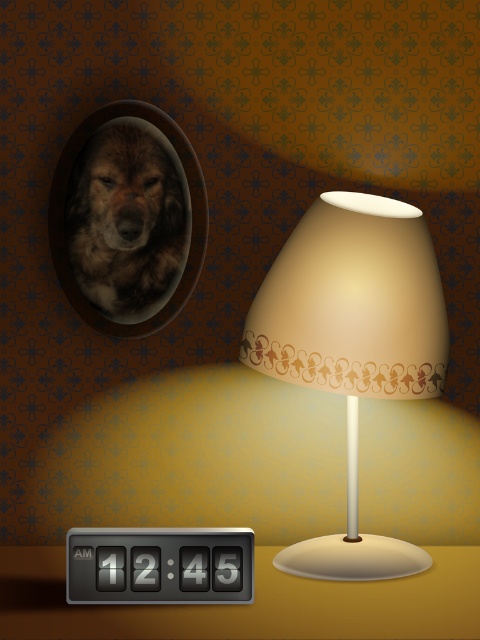
Is matte beige lampshade at center shorter than black plastic thermostat at bottom left?

In fact, matte beige lampshade at center may be taller than black plastic thermostat at bottom left.

Which of these two, matte beige lampshade at center or black plastic thermostat at bottom left, stands taller?

Standing taller between the two is matte beige lampshade at center.

Find the location of a particular element. The image size is (480, 640). matte beige lampshade at center is located at coordinates (352, 344).

Locate an element on the screen. Image resolution: width=480 pixels, height=640 pixels. matte beige lampshade at center is located at coordinates (352, 344).

Can you confirm if fuzzy brown dog at upper left is positioned above black plastic thermostat at bottom left?

Yes.

Is point (137, 129) positioned behind point (112, 576)?

Yes.

You are a GUI agent. You are given a task and a screenshot of the screen. Output one action in this format:
    pyautogui.click(x=<x>, y=<y>)
    Task: Click on the fuzzy brown dog at upper left
    The height and width of the screenshot is (640, 480).
    Given the screenshot: What is the action you would take?
    pyautogui.click(x=124, y=220)

Which is below, matte beige lampshade at center or fuzzy brown dog at upper left?

Positioned lower is matte beige lampshade at center.

Is matte beige lampshade at center bigger than fuzzy brown dog at upper left?

Correct, matte beige lampshade at center is larger in size than fuzzy brown dog at upper left.

Does point (241, 353) come behind point (99, 237)?

No, it is in front of (99, 237).

At what (x,y) coordinates should I click in order to perform the action: click on matte beige lampshade at center. Please return your answer as a coordinate pair (x, y). Looking at the image, I should click on (352, 344).